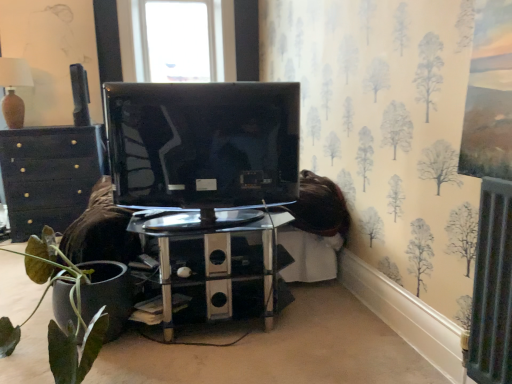
Identify the location of vacant area situated below metallic gray speaker at upper left (from a real-world perspective). Image resolution: width=512 pixels, height=384 pixels. 82,129.